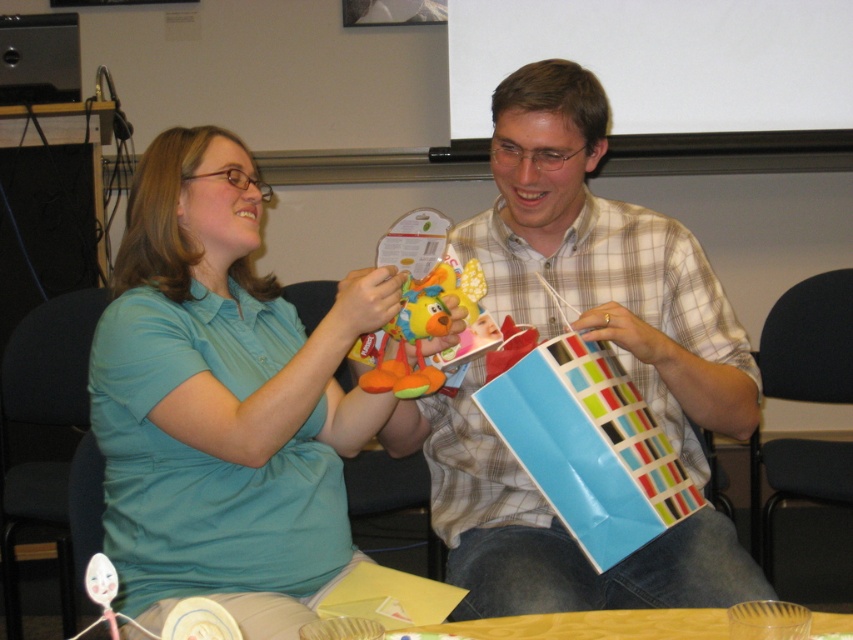
You are standing in front of the scene and want to know how far the point at coordinates (152, 529) is from you. Can you determine the distance?

The point at coordinates (152, 529) is 4.06 feet away from the camera, so the distance from you to the point is approximately 4.06 feet.

You are a photographer standing 1 meter away from the teal matte shirt at upper left and the soft plush toy at center. You want to take a photo that includes both objects in the frame. Given that your camera has a maximum focus range of 1.5 meters, will both objects be in focus?

The teal matte shirt at upper left is 21.61 centimeters from the soft plush toy at center. Since both objects are within the 1.5 meter focus range of the camera, they will both be in focus.